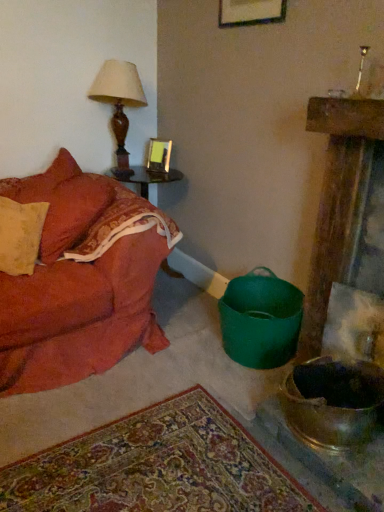
Question: Is matte glass picture frame at upper center facing away from velvet orange couch at left?

Choices:
 (A) yes
 (B) no

Answer: (B)

Question: Is matte glass picture frame at upper center taller than velvet orange couch at left?

Choices:
 (A) no
 (B) yes

Answer: (A)

Question: Is matte glass picture frame at upper center with velvet orange couch at left?

Choices:
 (A) yes
 (B) no

Answer: (B)

Question: Would you say velvet orange couch at left is part of matte glass picture frame at upper center's contents?

Choices:
 (A) yes
 (B) no

Answer: (B)

Question: Considering the relative sizes of matte glass picture frame at upper center and velvet orange couch at left in the image provided, is matte glass picture frame at upper center wider than velvet orange couch at left?

Choices:
 (A) yes
 (B) no

Answer: (B)

Question: Considering the positions of matte glass picture frame at upper center and wooden round table at left in the image, is matte glass picture frame at upper center wider or thinner than wooden round table at left?

Choices:
 (A) thin
 (B) wide

Answer: (A)

Question: From a real-world perspective, is matte glass picture frame at upper center above or below wooden round table at left?

Choices:
 (A) above
 (B) below

Answer: (A)

Question: From the image's perspective, relative to wooden round table at left, is matte glass picture frame at upper center above or below?

Choices:
 (A) below
 (B) above

Answer: (B)

Question: Based on their sizes in the image, would you say matte glass picture frame at upper center is bigger or smaller than wooden round table at left?

Choices:
 (A) big
 (B) small

Answer: (B)

Question: Is shiny metallic mixing bowl at lower right to the left or to the right of matte glass picture frame at upper center in the image?

Choices:
 (A) left
 (B) right

Answer: (B)

Question: In terms of height, does shiny metallic mixing bowl at lower right look taller or shorter compared to matte glass picture frame at upper center?

Choices:
 (A) short
 (B) tall

Answer: (B)

Question: Is shiny metallic mixing bowl at lower right bigger or smaller than matte glass picture frame at upper center?

Choices:
 (A) big
 (B) small

Answer: (A)

Question: Is shiny metallic mixing bowl at lower right inside or outside of matte glass picture frame at upper center?

Choices:
 (A) inside
 (B) outside

Answer: (B)

Question: From a real-world perspective, is velvet orange couch at left above or below matte brown table lamp at upper left?

Choices:
 (A) above
 (B) below

Answer: (B)

Question: In terms of width, does velvet orange couch at left look wider or thinner when compared to matte brown table lamp at upper left?

Choices:
 (A) thin
 (B) wide

Answer: (B)